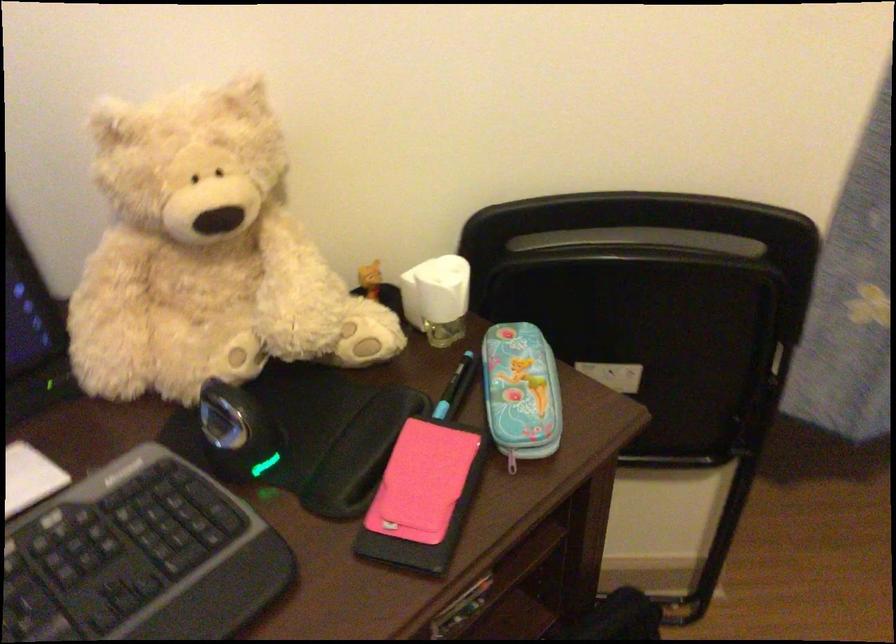
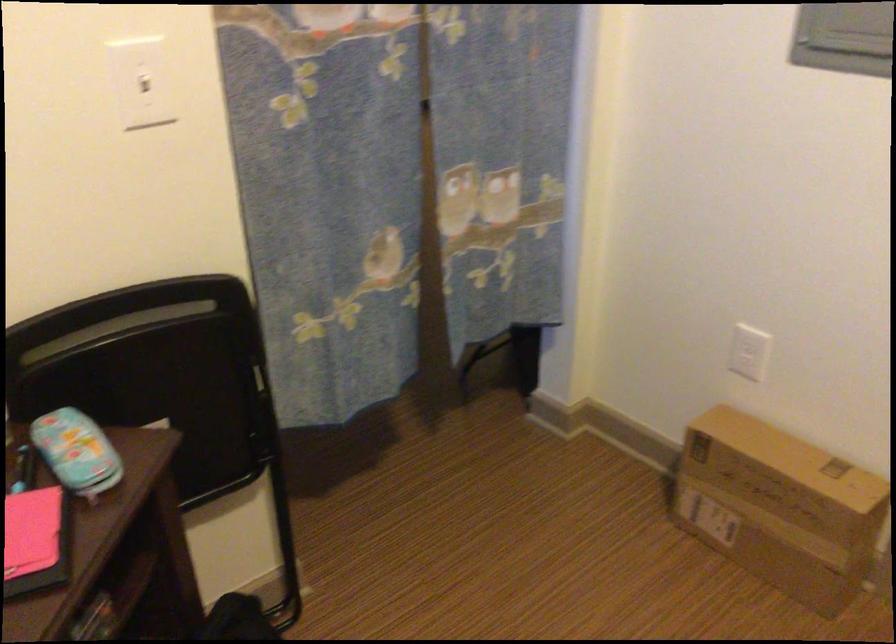
Question: The first image is from the beginning of the video and the second image is from the end. How did the camera likely rotate when shooting the video?

Choices:
 (A) Left
 (B) Right
 (C) Up
 (D) Down

Answer: (B)